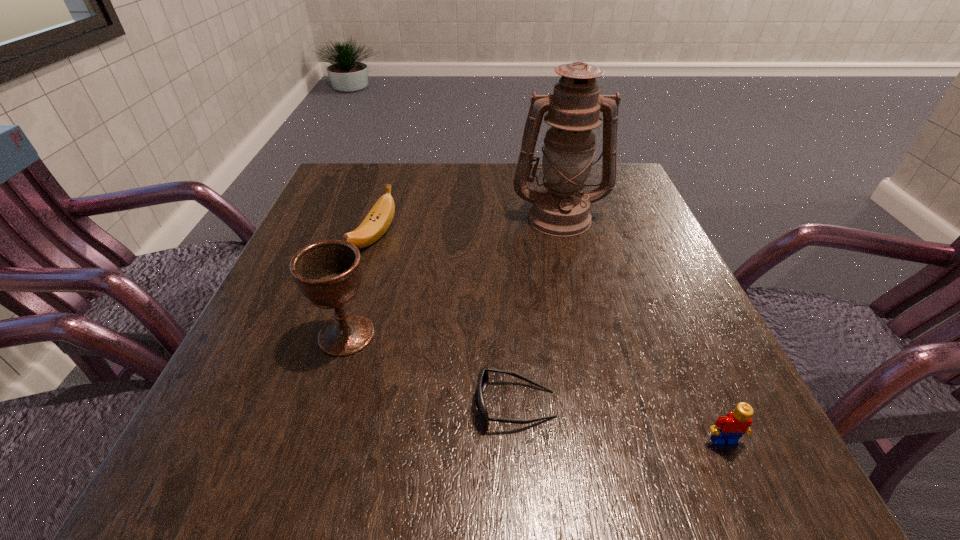
Select which object appears as the third closest to the sunglasses. Please provide its 2D coordinates. Your answer should be formatted as a tuple, i.e. [(x, y)], where the tuple contains the x and y coordinates of a point satisfying the conditions above.

[(378, 220)]

You are a GUI agent. You are given a task and a screenshot of the screen. Output one action in this format:
    pyautogui.click(x=<x>, y=<y>)
    Task: Click on the second closest object to the third nearest object
    The image size is (960, 540).
    Given the screenshot: What is the action you would take?
    pyautogui.click(x=483, y=378)